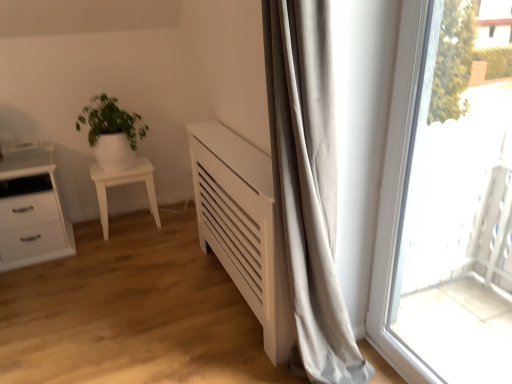
Question: Should I look upward or downward to see transparent glass window at right?

Choices:
 (A) up
 (B) down

Answer: (B)

Question: Would you consider white glossy chest of drawers at left to be distant from white glossy pot at left?

Choices:
 (A) no
 (B) yes

Answer: (A)

Question: From the image's perspective, is white glossy chest of drawers at left located beneath white glossy pot at left?

Choices:
 (A) no
 (B) yes

Answer: (B)

Question: From a real-world perspective, is white glossy chest of drawers at left physically below white glossy pot at left?

Choices:
 (A) yes
 (B) no

Answer: (A)

Question: Considering the relative sizes of white glossy chest of drawers at left and white glossy pot at left in the image provided, is white glossy chest of drawers at left taller than white glossy pot at left?

Choices:
 (A) no
 (B) yes

Answer: (B)

Question: Does white glossy chest of drawers at left lie in front of white glossy pot at left?

Choices:
 (A) no
 (B) yes

Answer: (B)

Question: Is white glossy pot at left completely or partially inside white glossy chest of drawers at left?

Choices:
 (A) yes
 (B) no

Answer: (B)

Question: Does white glossy side table at left contain white glossy pot at left?

Choices:
 (A) no
 (B) yes

Answer: (A)

Question: Is white glossy side table at left to the right of white glossy pot at left from the viewer's perspective?

Choices:
 (A) no
 (B) yes

Answer: (B)

Question: From a real-world perspective, is white glossy side table at left beneath white glossy pot at left?

Choices:
 (A) no
 (B) yes

Answer: (B)

Question: Is white glossy side table at left positioned in front of white glossy pot at left?

Choices:
 (A) yes
 (B) no

Answer: (B)

Question: Is the surface of white glossy side table at left in direct contact with white glossy pot at left?

Choices:
 (A) no
 (B) yes

Answer: (A)

Question: From the image's perspective, does white glossy side table at left appear higher than white glossy pot at left?

Choices:
 (A) yes
 (B) no

Answer: (B)

Question: Considering the relative sizes of transparent glass window at right and white glossy chest of drawers at left in the image provided, is transparent glass window at right taller than white glossy chest of drawers at left?

Choices:
 (A) no
 (B) yes

Answer: (B)